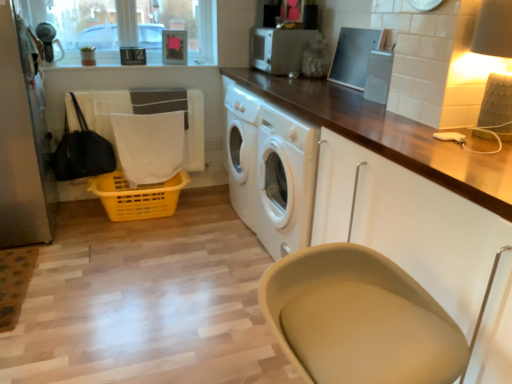
The height and width of the screenshot is (384, 512). Identify the location of matte cream lampshade at upper right. (493, 29).

Measure the distance between beige fabric feeding chair at lower center and camera.

The depth of beige fabric feeding chair at lower center is 33.45 inches.

Where is `clear glass window screen at upper left`? clear glass window screen at upper left is located at coordinates (82, 27).

The image size is (512, 384). I want to click on matte cream lampshade at upper right, so click(x=493, y=29).

In the scene shown: Which point is more distant from viewer, (373, 66) or (150, 188)?

The point (150, 188) is farther.

Is clear plastic container at upper center, positioned as the 2th appliance in top-to-bottom order, to the right of yellow plastic basket at lower left from the viewer's perspective?

Indeed, clear plastic container at upper center, positioned as the 2th appliance in top-to-bottom order, is positioned on the right side of yellow plastic basket at lower left.

Is yellow plastic basket at lower left completely or partially inside clear plastic container at upper center, the first appliance in the bottom-to-top sequence?

No, clear plastic container at upper center, the first appliance in the bottom-to-top sequence, does not contain yellow plastic basket at lower left.

From the picture: Can you confirm if satin silver toaster at upper center, the second appliance ordered from the bottom, is taller than beige fabric feeding chair at lower center?

In fact, satin silver toaster at upper center, the second appliance ordered from the bottom, may be shorter than beige fabric feeding chair at lower center.

What's the angular difference between satin silver toaster at upper center, placed as the 1th appliance when sorted from top to bottom, and beige fabric feeding chair at lower center's facing directions?

The angle between the facing direction of satin silver toaster at upper center, placed as the 1th appliance when sorted from top to bottom, and the facing direction of beige fabric feeding chair at lower center is 99 degrees.

From a real-world perspective, between satin silver toaster at upper center, placed as the 1th appliance when sorted from top to bottom, and beige fabric feeding chair at lower center, who is vertically lower?

From a 3D spatial view, beige fabric feeding chair at lower center is below.

Does point (283, 65) come behind point (298, 345)?

Yes.

Considering the positions of point (266, 294) and point (494, 117), is point (266, 294) closer or farther from the camera than point (494, 117)?

Point (266, 294) is positioned closer to the camera compared to point (494, 117).

The height and width of the screenshot is (384, 512). In order to click on lamp above the beige fabric feeding chair at lower center (from the image's perspective) in this screenshot , I will do `click(493, 29)`.

Consider the image. Which is more to the left, beige fabric feeding chair at lower center or matte cream lampshade at upper right?

Positioned to the left is beige fabric feeding chair at lower center.

Can we say beige fabric feeding chair at lower center lies outside matte cream lampshade at upper right?

That's correct, beige fabric feeding chair at lower center is outside of matte cream lampshade at upper right.

Between white fabric laundry at left and clear plastic container at upper center, marked as the 2th appliance in a back-to-front arrangement, which one is positioned behind?

Positioned behind is white fabric laundry at left.

Between white fabric laundry at left and clear plastic container at upper center, which is the 1th appliance from front to back, which one has smaller size?

clear plastic container at upper center, which is the 1th appliance from front to back, is smaller.

How different are the orientations of white fabric laundry at left and clear plastic container at upper center, marked as the 2th appliance in a back-to-front arrangement, in degrees?

white fabric laundry at left and clear plastic container at upper center, marked as the 2th appliance in a back-to-front arrangement, are facing 91.1 degrees away from each other.

In the image, is white fabric laundry at left on the left side or the right side of clear plastic container at upper center, positioned as the 2th appliance in top-to-bottom order?

white fabric laundry at left is positioned on clear plastic container at upper center, positioned as the 2th appliance in top-to-bottom order,'s left side.

From a real-world perspective, which is physically above, clear plastic container at upper center, positioned as the 1th appliance in right-to-left order, or satin silver screen door at left?

clear plastic container at upper center, positioned as the 1th appliance in right-to-left order.

Is point (376, 63) closer or farther from the camera than point (27, 210)?

Clearly, point (376, 63) is closer to the camera than point (27, 210).

Which object is positioned more to the left, clear plastic container at upper center, positioned as the 2th appliance in top-to-bottom order, or satin silver screen door at left?

Positioned to the left is satin silver screen door at left.

Is there a large distance between clear plastic container at upper center, marked as the 2th appliance in a back-to-front arrangement, and satin silver screen door at left?

Yes, clear plastic container at upper center, marked as the 2th appliance in a back-to-front arrangement, and satin silver screen door at left are located far from each other.

Consider the image. Considering the sizes of objects beige fabric feeding chair at lower center and clear plastic container at upper center, the second appliance in the left-to-right sequence, in the image provided, who is shorter, beige fabric feeding chair at lower center or clear plastic container at upper center, the second appliance in the left-to-right sequence,?

Standing shorter between the two is clear plastic container at upper center, the second appliance in the left-to-right sequence.

Is beige fabric feeding chair at lower center aimed at clear plastic container at upper center, the second appliance in the left-to-right sequence?

No, beige fabric feeding chair at lower center is not aimed at clear plastic container at upper center, the second appliance in the left-to-right sequence.

Choose the correct answer: Is beige fabric feeding chair at lower center inside clear plastic container at upper center, marked as the 2th appliance in a back-to-front arrangement, or outside it?

beige fabric feeding chair at lower center is spatially situated outside clear plastic container at upper center, marked as the 2th appliance in a back-to-front arrangement.

Does beige fabric feeding chair at lower center have a larger size compared to clear plastic container at upper center, the first appliance in the bottom-to-top sequence?

Yes.

Between clear glass window screen at upper left and matte cream lampshade at upper right, which one has larger size?

With larger size is clear glass window screen at upper left.

Can you confirm if clear glass window screen at upper left is taller than matte cream lampshade at upper right?

Yes, clear glass window screen at upper left is taller than matte cream lampshade at upper right.

Based on the photo, in terms of width, does clear glass window screen at upper left look wider or thinner when compared to matte cream lampshade at upper right?

clear glass window screen at upper left is thinner than matte cream lampshade at upper right.

Is the surface of clear glass window screen at upper left in direct contact with matte cream lampshade at upper right?

They are not placed beside each other.

Starting from the yellow plastic basket at lower left, which appliance is the 2nd one to the right? Please provide its 2D coordinates.

[(379, 75)]

You are a GUI agent. You are given a task and a screenshot of the screen. Output one action in this format:
    pyautogui.click(x=<x>, y=<y>)
    Task: Click on the feeding chair in front of the satin silver toaster at upper center, the first appliance from the left
    The width and height of the screenshot is (512, 384).
    Given the screenshot: What is the action you would take?
    pyautogui.click(x=359, y=319)

Looking at the image, which one is located further to clear plastic container at upper center, positioned as the 1th appliance in right-to-left order, satin silver screen door at left or white fabric at lower left?

satin silver screen door at left is further to clear plastic container at upper center, positioned as the 1th appliance in right-to-left order.

From the image, which object appears to be nearer to clear glass window screen at upper left, satin silver screen door at left or white fabric laundry at left?

white fabric laundry at left is positioned closer to the anchor clear glass window screen at upper left.

Estimate the real-world distances between objects in this image. Which object is further from white fabric laundry at left, satin silver screen door at left or clear plastic container at upper center, the second appliance in the left-to-right sequence?

Based on the image, clear plastic container at upper center, the second appliance in the left-to-right sequence, appears to be further to white fabric laundry at left.

Looking at the image, which one is located closer to white fabric laundry at left, clear glass window screen at upper left or satin silver screen door at left?

Based on the image, clear glass window screen at upper left appears to be nearer to white fabric laundry at left.

Estimate the real-world distances between objects in this image. Which object is closer to beige fabric feeding chair at lower center, matte cream lampshade at upper right or satin silver toaster at upper center, placed as the 1th appliance when sorted from top to bottom?

matte cream lampshade at upper right.

Based on their spatial positions, is white fabric laundry at left or yellow plastic basket at lower left closer to satin silver toaster at upper center, the 2th appliance viewed from the right?

Based on the image, white fabric laundry at left appears to be nearer to satin silver toaster at upper center, the 2th appliance viewed from the right.

Which object lies further to the anchor point white fabric at lower left, satin silver screen door at left or matte cream lampshade at upper right?

The object further to white fabric at lower left is matte cream lampshade at upper right.

Estimate the real-world distances between objects in this image. Which object is further from yellow plastic basket at lower left, white fabric at lower left or white fabric laundry at left?

white fabric laundry at left lies further to yellow plastic basket at lower left than the other object.

I want to click on appliance between matte cream lampshade at upper right and satin silver toaster at upper center, the second appliance ordered from the bottom, along the z-axis, so click(x=379, y=75).

Identify the location of screen door between beige fabric feeding chair at lower center and white fabric at lower left along the z-axis. (21, 149).

Locate an element on the screen. The height and width of the screenshot is (384, 512). basket situated between satin silver screen door at left and matte cream lampshade at upper right from left to right is located at coordinates (137, 196).

Locate an element on the screen. clothe between white fabric laundry at left and yellow plastic basket at lower left in the up-down direction is located at coordinates (149, 146).